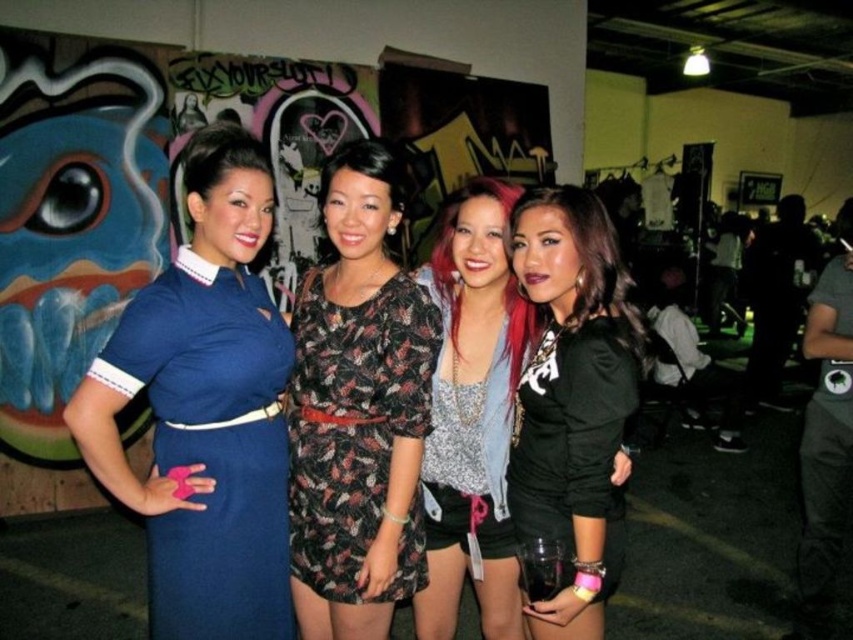
Question: Can you confirm if black matte shirt at center is positioned below sparkly silver top at center?

Choices:
 (A) no
 (B) yes

Answer: (A)

Question: Among these objects, which one is nearest to the camera?

Choices:
 (A) floral-patterned fabric dress at center
 (B) black matte shirt at center

Answer: (B)

Question: Is floral-patterned fabric dress at center positioned at the back of sparkly silver top at center?

Choices:
 (A) no
 (B) yes

Answer: (A)

Question: Which point appears closest to the camera in this image?

Choices:
 (A) (386, 467)
 (B) (579, 243)
 (C) (224, 259)
 (D) (440, 234)

Answer: (B)

Question: Is floral-patterned fabric dress at center thinner than sparkly silver top at center?

Choices:
 (A) no
 (B) yes

Answer: (A)

Question: Which object is the farthest from the blue fabric dress at left?

Choices:
 (A) black matte shirt at center
 (B) floral-patterned fabric dress at center
 (C) sparkly silver top at center

Answer: (A)